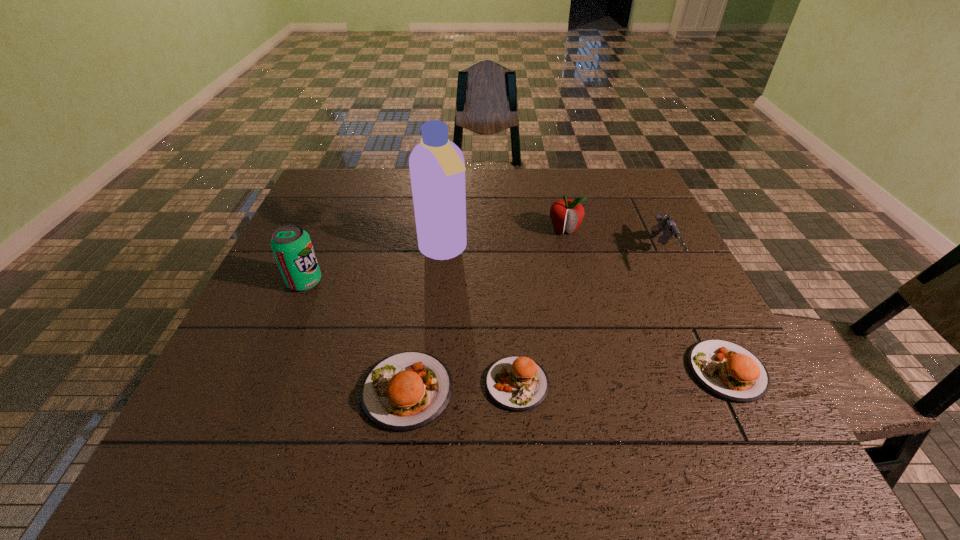
Please point a spot to place another patty_(food) for symmetrical spacing. Please provide its 2D coordinates. Your answer should be formatted as a tuple, i.e. [(x, y)], where the tuple contains the x and y coordinates of a point satisfying the conditions above.

[(623, 377)]